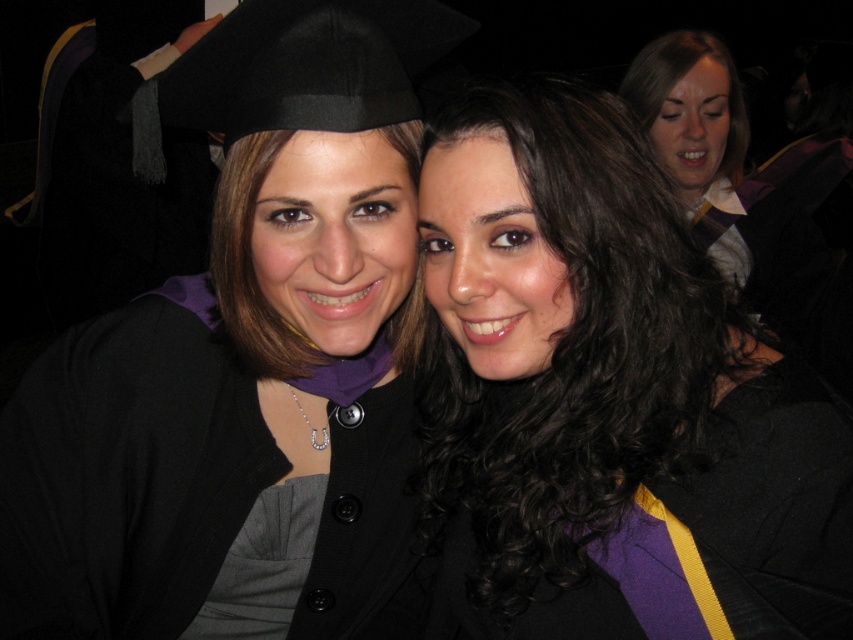
Can you confirm if matte black graduation cap at upper left is wider than dark brown curly hair at center?

Indeed, matte black graduation cap at upper left has a greater width compared to dark brown curly hair at center.

Locate an element on the screen. This screenshot has width=853, height=640. matte black graduation cap at upper left is located at coordinates pyautogui.click(x=245, y=371).

Locate an element on the screen. This screenshot has width=853, height=640. matte black graduation cap at upper left is located at coordinates (245, 371).